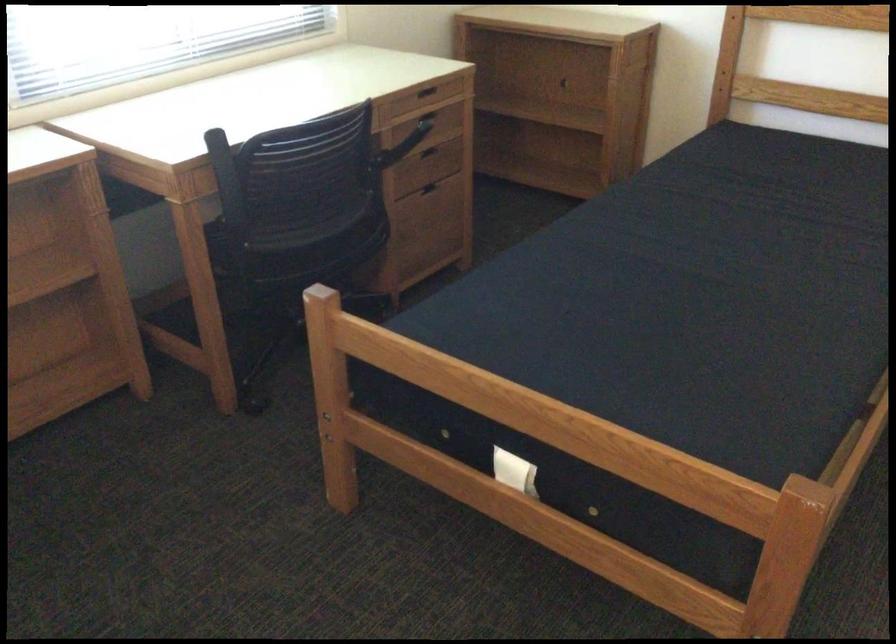
Where is `chair sitting surface`? chair sitting surface is located at coordinates (225, 252).